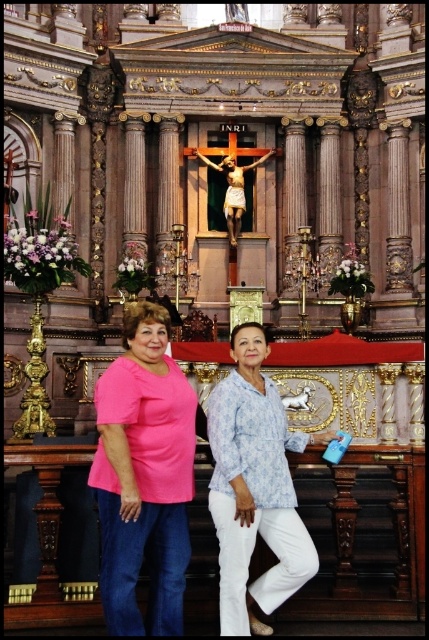
Question: Estimate the real-world distances between objects in this image. Which object is farther from the pink matte shirt at center?

Choices:
 (A) blue printed blouse at center
 (B) pink fabric shirt at center

Answer: (A)

Question: Which point is farther from the camera taking this photo?

Choices:
 (A) (248, 464)
 (B) (106, 435)

Answer: (A)

Question: Is pink fabric shirt at center thinner than blue printed blouse at center?

Choices:
 (A) no
 (B) yes

Answer: (A)

Question: Is pink fabric shirt at center positioned at the back of blue printed blouse at center?

Choices:
 (A) no
 (B) yes

Answer: (A)

Question: Which of the following is the farthest from the observer?

Choices:
 (A) (235, 381)
 (B) (168, 413)
 (C) (171, 452)

Answer: (A)

Question: Where is pink fabric shirt at center located in relation to blue printed blouse at center in the image?

Choices:
 (A) right
 (B) left

Answer: (B)